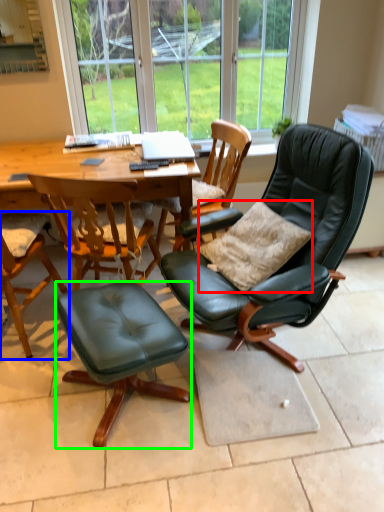
Question: Which object is positioned closest to pillow (highlighted by a red box)? Select from chair (highlighted by a blue box) and stool (highlighted by a green box).

Choices:
 (A) chair
 (B) stool

Answer: (B)